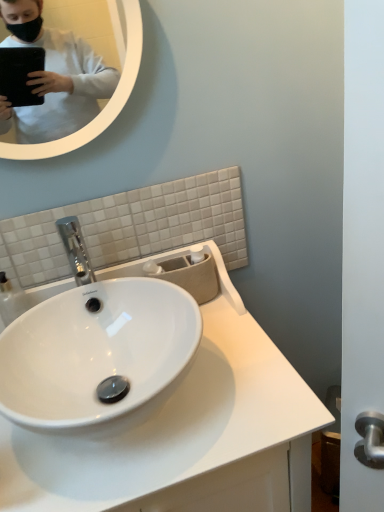
Question: Is white glossy sink at center thinner than white glossy mirror at upper left?

Choices:
 (A) no
 (B) yes

Answer: (A)

Question: Could you tell me if white glossy sink at center is turned towards white glossy mirror at upper left?

Choices:
 (A) no
 (B) yes

Answer: (A)

Question: From a real-world perspective, is white glossy sink at center physically below white glossy mirror at upper left?

Choices:
 (A) yes
 (B) no

Answer: (A)

Question: Is white glossy sink at center not near white glossy mirror at upper left?

Choices:
 (A) yes
 (B) no

Answer: (B)

Question: Is white glossy mirror at upper left inside white glossy sink at center?

Choices:
 (A) no
 (B) yes

Answer: (A)

Question: Would you say white glossy sink at center is outside white glossy mirror at upper left?

Choices:
 (A) no
 (B) yes

Answer: (B)

Question: Could you tell me if white glossy mirror at upper left is turned towards white glossy sink at center?

Choices:
 (A) no
 (B) yes

Answer: (A)

Question: Considering the relative sizes of white glossy mirror at upper left and white glossy sink at center in the image provided, is white glossy mirror at upper left smaller than white glossy sink at center?

Choices:
 (A) no
 (B) yes

Answer: (B)

Question: From the image's perspective, is white glossy mirror at upper left beneath white glossy sink at center?

Choices:
 (A) yes
 (B) no

Answer: (B)

Question: Does white glossy mirror at upper left lie behind white glossy sink at center?

Choices:
 (A) yes
 (B) no

Answer: (A)

Question: Can you confirm if white glossy mirror at upper left is shorter than white glossy sink at center?

Choices:
 (A) no
 (B) yes

Answer: (B)

Question: Is white glossy mirror at upper left bigger than white glossy sink at center?

Choices:
 (A) no
 (B) yes

Answer: (A)

Question: From a real-world perspective, is white glossy mirror at upper left physically located above or below white glossy sink at center?

Choices:
 (A) below
 (B) above

Answer: (B)